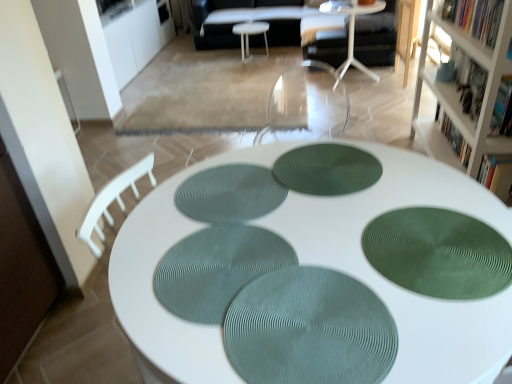
You are a GUI agent. You are given a task and a screenshot of the screen. Output one action in this format:
    pyautogui.click(x=<x>, y=<y>)
    Task: Click on the empty space that is ontop of green textured placemat at center, the 2th mat viewed from the right
    This screenshot has width=512, height=384.
    Given the screenshot: What is the action you would take?
    pyautogui.click(x=328, y=166)